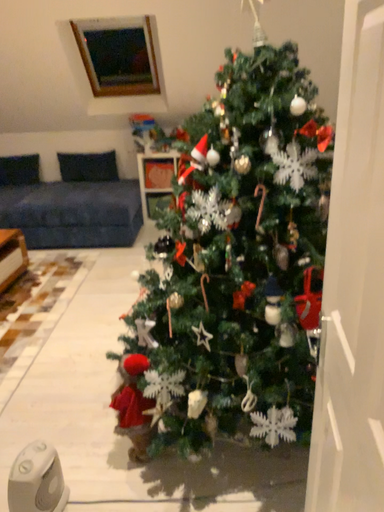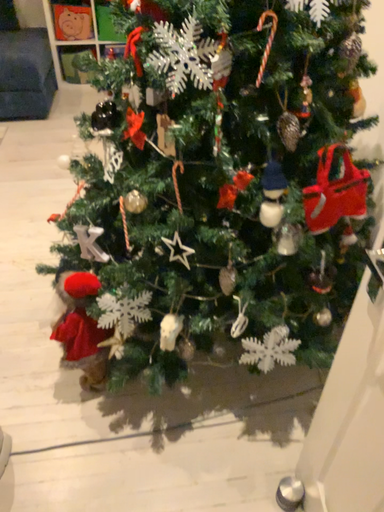
Question: Which way did the camera rotate in the video?

Choices:
 (A) rotated upward
 (B) rotated downward

Answer: (B)